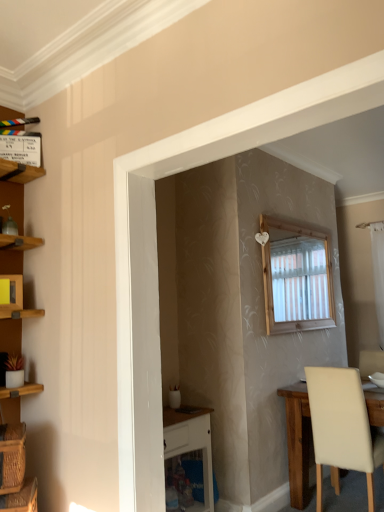
Question: Is wooden clapperboard at upper left, the first cabinet when ordered from top to bottom, shorter than white sheer curtain at right?

Choices:
 (A) yes
 (B) no

Answer: (A)

Question: Considering the relative sizes of wooden clapperboard at upper left, which ranks as the 2th cabinet in bottom-to-top order, and white sheer curtain at right in the image provided, is wooden clapperboard at upper left, which ranks as the 2th cabinet in bottom-to-top order, bigger than white sheer curtain at right?

Choices:
 (A) yes
 (B) no

Answer: (B)

Question: Is wooden clapperboard at upper left, the first cabinet when ordered from top to bottom, positioned with its back to white sheer curtain at right?

Choices:
 (A) yes
 (B) no

Answer: (B)

Question: Can you confirm if wooden clapperboard at upper left, the 1th cabinet viewed from the back, is thinner than white sheer curtain at right?

Choices:
 (A) no
 (B) yes

Answer: (B)

Question: From a real-world perspective, is wooden clapperboard at upper left, which ranks as the 2th cabinet in bottom-to-top order, below white sheer curtain at right?

Choices:
 (A) yes
 (B) no

Answer: (B)

Question: Can you confirm if wooden clapperboard at upper left, which appears as the second cabinet when viewed from the front, is positioned to the right of white sheer curtain at right?

Choices:
 (A) no
 (B) yes

Answer: (A)

Question: Is woven brown basket at lower left, the first basket positioned from the bottom, thinner than wooden clapperboard at upper left, the 1th cabinet viewed from the back?

Choices:
 (A) no
 (B) yes

Answer: (A)

Question: From the image's perspective, is woven brown basket at lower left, the first basket positioned from the bottom, located beneath wooden clapperboard at upper left, which ranks as the 2th cabinet in bottom-to-top order?

Choices:
 (A) no
 (B) yes

Answer: (B)

Question: Does woven brown basket at lower left, the first basket positioned from the bottom, have a larger size compared to wooden clapperboard at upper left, the 1th cabinet viewed from the back?

Choices:
 (A) yes
 (B) no

Answer: (A)

Question: From a real-world perspective, is woven brown basket at lower left, the first basket positioned from the bottom, beneath wooden clapperboard at upper left, the 1th cabinet viewed from the back?

Choices:
 (A) yes
 (B) no

Answer: (A)

Question: Can you confirm if woven brown basket at lower left, the first basket positioned from the bottom, is wider than wooden clapperboard at upper left, which appears as the second cabinet when viewed from the front?

Choices:
 (A) yes
 (B) no

Answer: (A)

Question: Is wooden clapperboard at upper left, the 1th cabinet viewed from the back, completely or partially inside woven brown basket at lower left, the first basket positioned from the bottom?

Choices:
 (A) no
 (B) yes

Answer: (A)

Question: Could you tell me if beige leather chair at lower right is facing yellow matte cabinet at upper left, positioned as the first cabinet in bottom-to-top order?

Choices:
 (A) no
 (B) yes

Answer: (A)